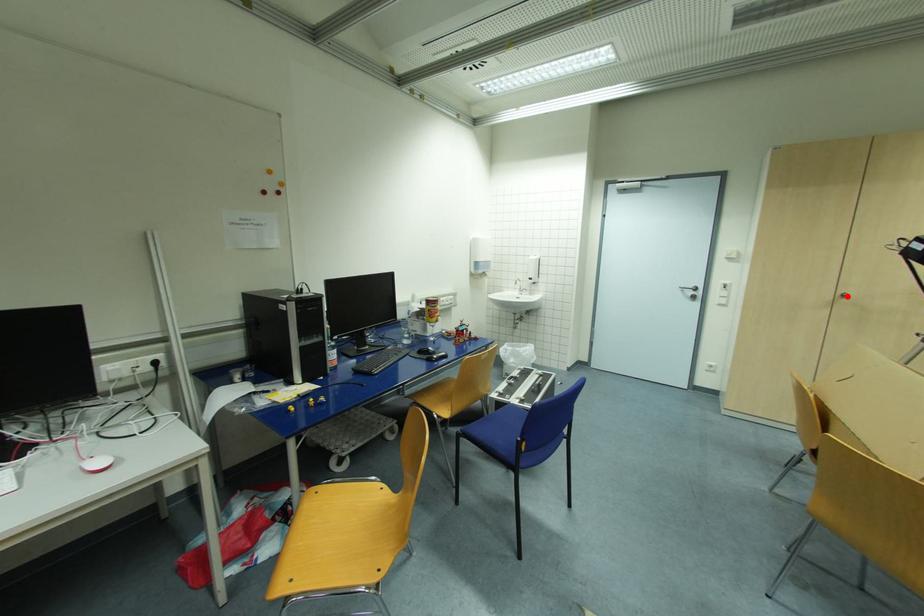
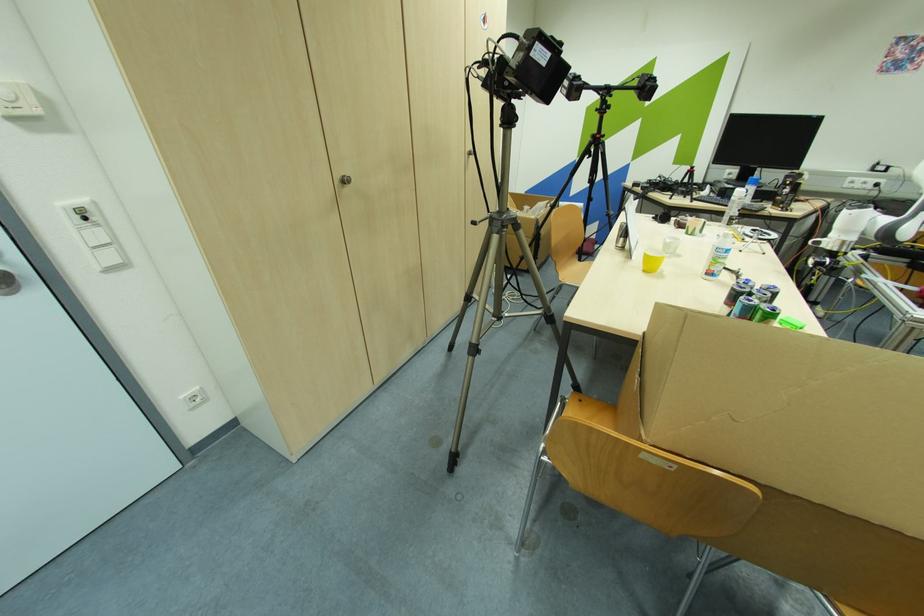
The point at the highlighted location is marked in the first image. Where is the corresponding point in the second image?

(348, 182)